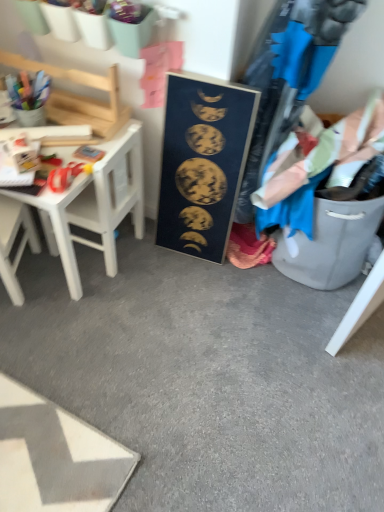
This screenshot has height=512, width=384. I want to click on free space in front of white plastic chair at left, so click(20, 328).